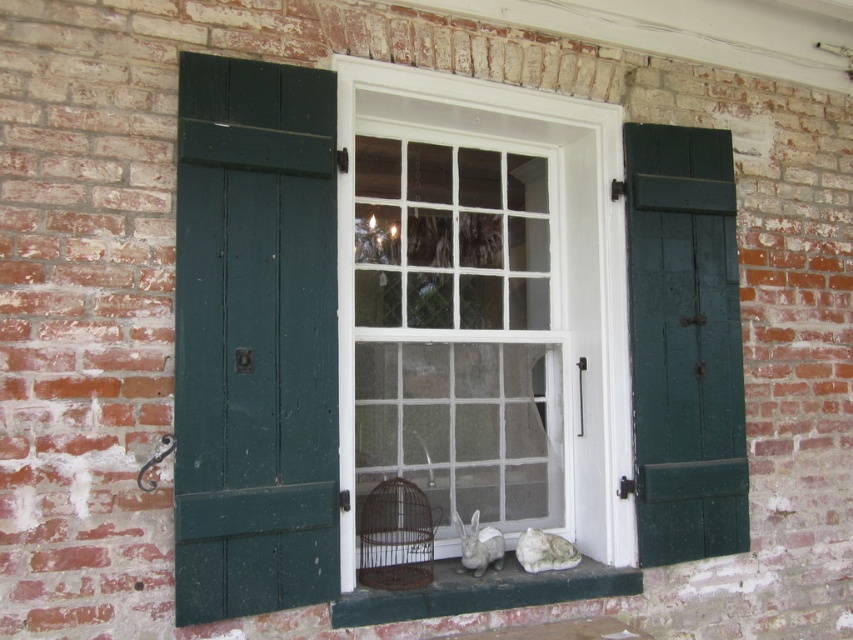
Does green wood shutter at left have a larger size compared to green painted wood at right?

Actually, green wood shutter at left might be smaller than green painted wood at right.

Who is more distant from viewer, (221, 330) or (643, 456)?

Point (643, 456)

Who is more forward, (263, 336) or (709, 262)?

Positioned in front is point (263, 336).

Where is `green wood shutter at left`? Image resolution: width=853 pixels, height=640 pixels. green wood shutter at left is located at coordinates (254, 339).

How far apart are white painted wood window frame at center and rusty metal birdcage at center?

white painted wood window frame at center is 14.50 inches from rusty metal birdcage at center.

Can you confirm if white painted wood window frame at center is thinner than rusty metal birdcage at center?

No.

Does point (497, 488) come in front of point (428, 554)?

No, it is behind (428, 554).

Locate an element on the screen. white painted wood window frame at center is located at coordinates (485, 339).

Does green painted wood at right have a lesser height compared to rusty metal birdcage at center?

In fact, green painted wood at right may be taller than rusty metal birdcage at center.

Who is higher up, green painted wood at right or rusty metal birdcage at center?

green painted wood at right is higher up.

Who is more distant from viewer, [682,308] or [410,550]?

Positioned behind is point [682,308].

You are a GUI agent. You are given a task and a screenshot of the screen. Output one action in this format:
    pyautogui.click(x=<x>, y=<y>)
    Task: Click on the green painted wood at right
    
    Given the screenshot: What is the action you would take?
    pyautogui.click(x=683, y=342)